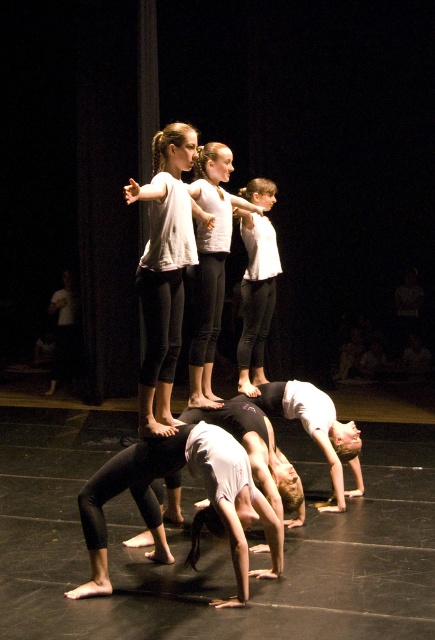
Based on the photo, you are a stagehand observing the dancers from the audience side. You notice two points marked on the stage floor at coordinates point (x=183, y=208) and point (x=240, y=193). Which point is closer to the audience?

Point (x=183, y=208) is in front of point (x=240, y=193), so it is closer to the audience.